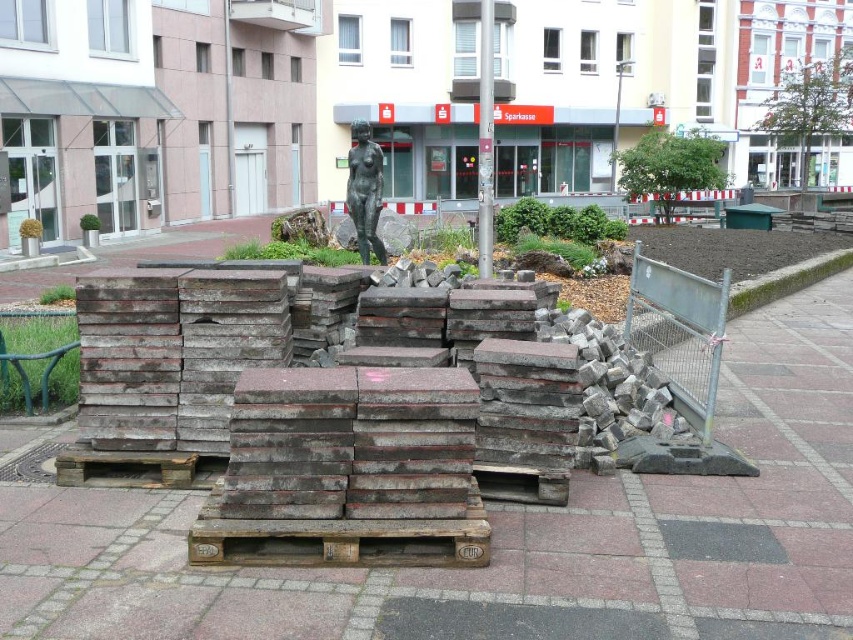
You are a construction worker tasked with moving the dark gray concrete paving stones at center to the other side of the bronze statue at center. Based on the scene, which direction should you move the stones relative to the statue?

The dark gray concrete paving stones at center is positioned on the right side of bronze statue at center, so you should move them to the left side of the bronze statue at center.

You are standing at the point with coordinates point (91, 595) and want to walk towards the sculpture. Will you pass by point (363, 236) on your way?

Yes, because point (91, 595) is in front of point (363, 236), so walking towards the sculpture from point (91, 595) would require passing through point (363, 236).

You are an urban planner assessing a construction site. You see the dark gray concrete paving stones at center and the bronze statue at center. Which object is smaller in size?

The dark gray concrete paving stones at center are smaller in size compared to the bronze statue at center.